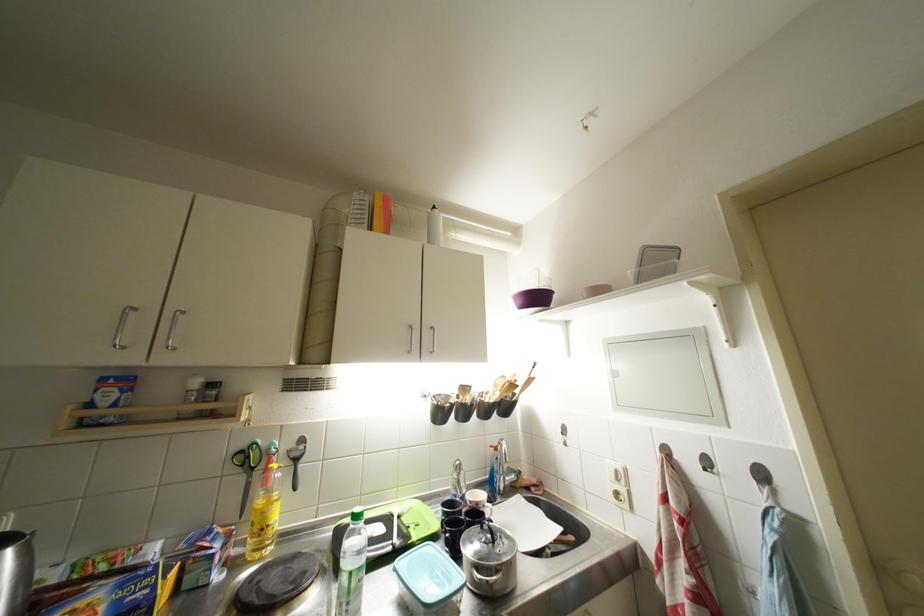
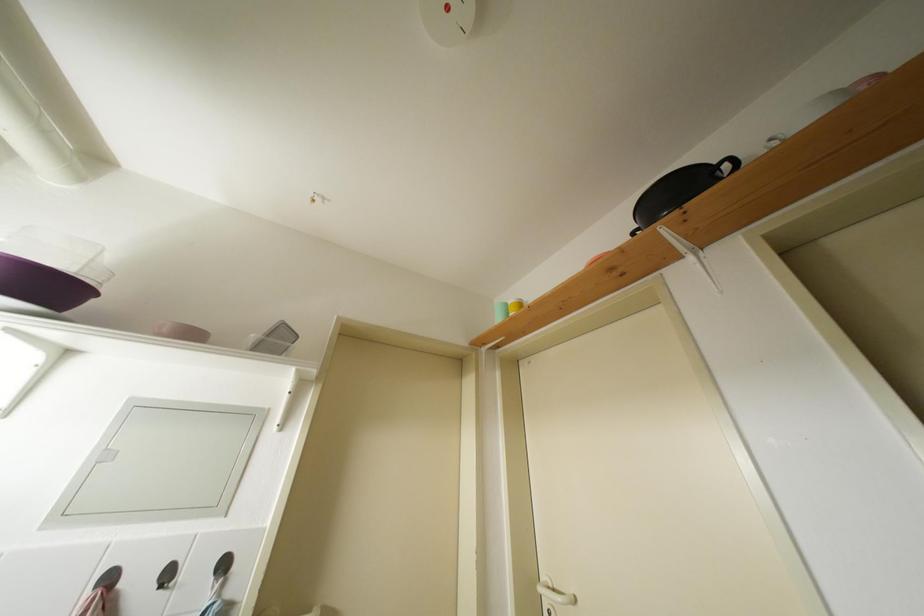
The images are taken continuously from a first-person perspective. In which direction is your viewpoint rotating?

The camera's rotation is toward right-up.